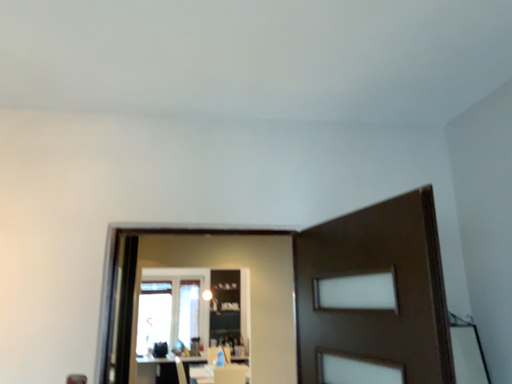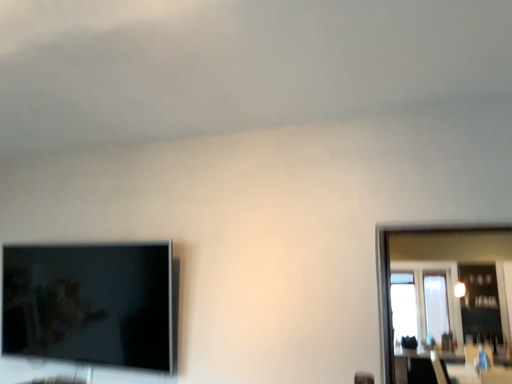
Question: How did the camera likely rotate when shooting the video?

Choices:
 (A) rotated left
 (B) rotated right

Answer: (A)